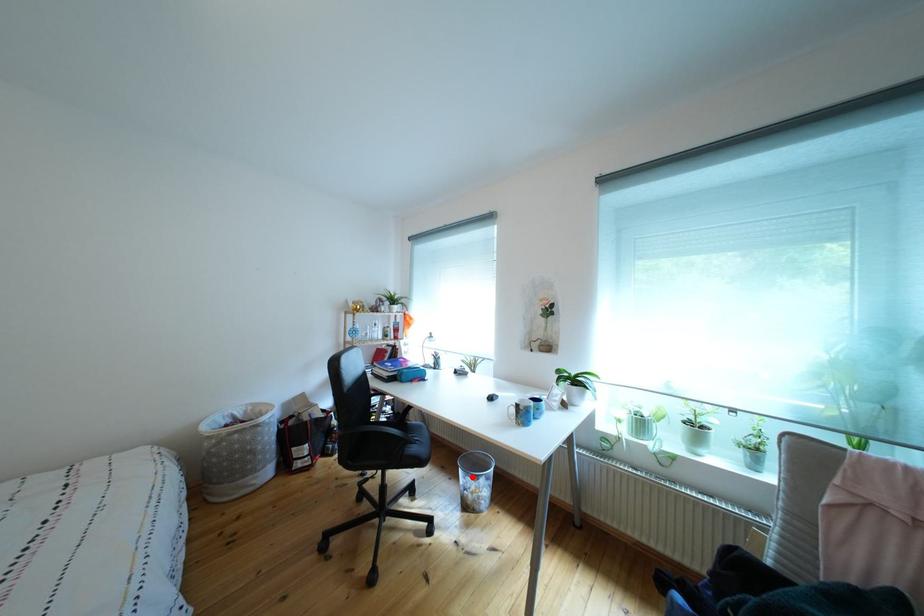
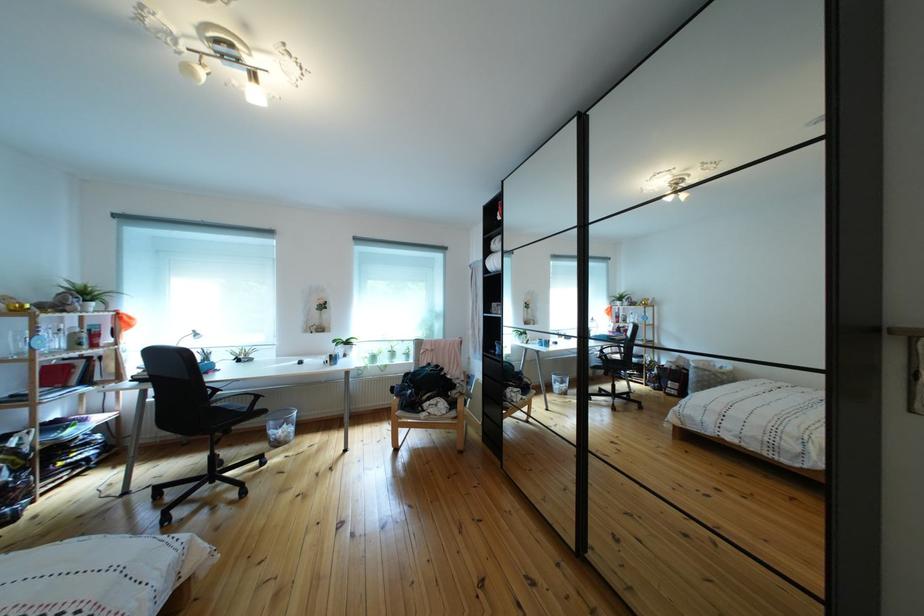
Question: I am providing you with two images of the same scene from different viewpoints. A red point is shown in image1. For the corresponding object point in image2, is it positioned nearer or farther from the camera?

Choices:
 (A) Nearer
 (B) Farther

Answer: (A)